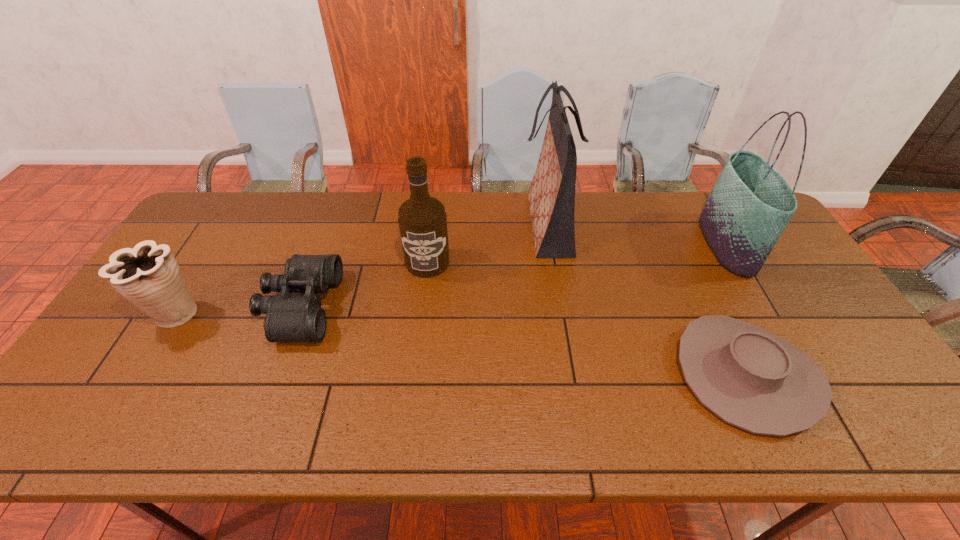
The width and height of the screenshot is (960, 540). I want to click on the fourth closest object to the third tallest object, so click(x=750, y=378).

The width and height of the screenshot is (960, 540). I want to click on vacant space that satisfies the following two spatial constraints: 1. on the back side of the tote bag; 2. on the right side of the leftmost object, so click(219, 244).

The width and height of the screenshot is (960, 540). I want to click on vacant space that satisfies the following two spatial constraints: 1. on the front side of the tote bag; 2. at the eyepieces of the second object from left to right, so (763, 306).

Locate an element on the screen. This screenshot has width=960, height=540. vacant space that satisfies the following two spatial constraints: 1. on the back side of the tote bag; 2. on the front-facing side of the shopping bag is located at coordinates (715, 224).

You are a GUI agent. You are given a task and a screenshot of the screen. Output one action in this format:
    pyautogui.click(x=<x>, y=<y>)
    Task: Click on the vacant space that satisfies the following two spatial constraints: 1. on the front-facing side of the cowboy hat; 2. on the left side of the shopping bag
    
    Given the screenshot: What is the action you would take?
    pyautogui.click(x=572, y=374)